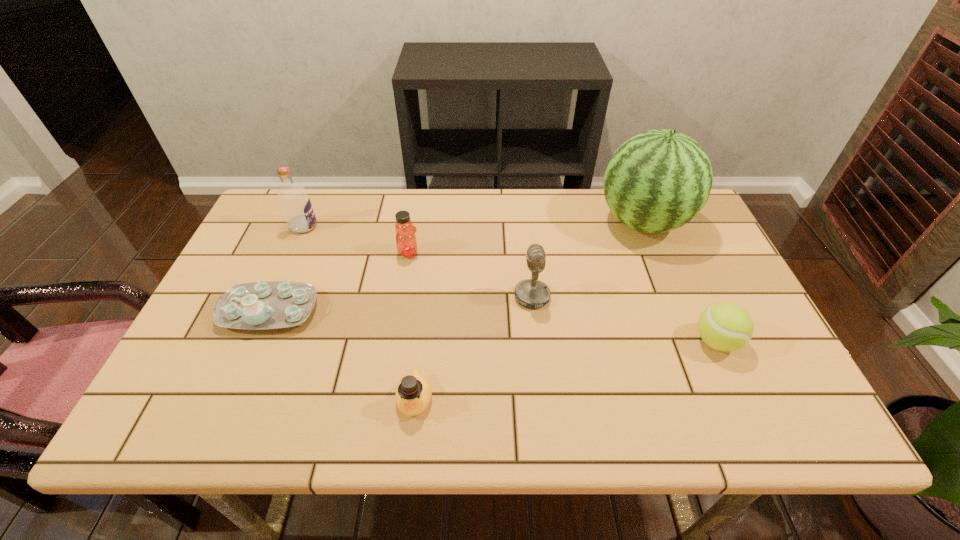
This screenshot has height=540, width=960. I want to click on empty location between the watermelon and the tennis ball, so click(680, 282).

I want to click on object that ranks as the second closest to the fifth object from left to right, so click(413, 394).

Identify the location of object that is the fifth closest to the nearest object. Image resolution: width=960 pixels, height=540 pixels. (657, 181).

Find the location of a particular element. vacant space that satisfies the following two spatial constraints: 1. on the label of the vodka; 2. on the right side of the tennis ball is located at coordinates [253, 341].

Image resolution: width=960 pixels, height=540 pixels. Identify the location of free location that satisfies the following two spatial constraints: 1. on the front-facing side of the fifth shortest object; 2. on the front side of the chinaware. (534, 310).